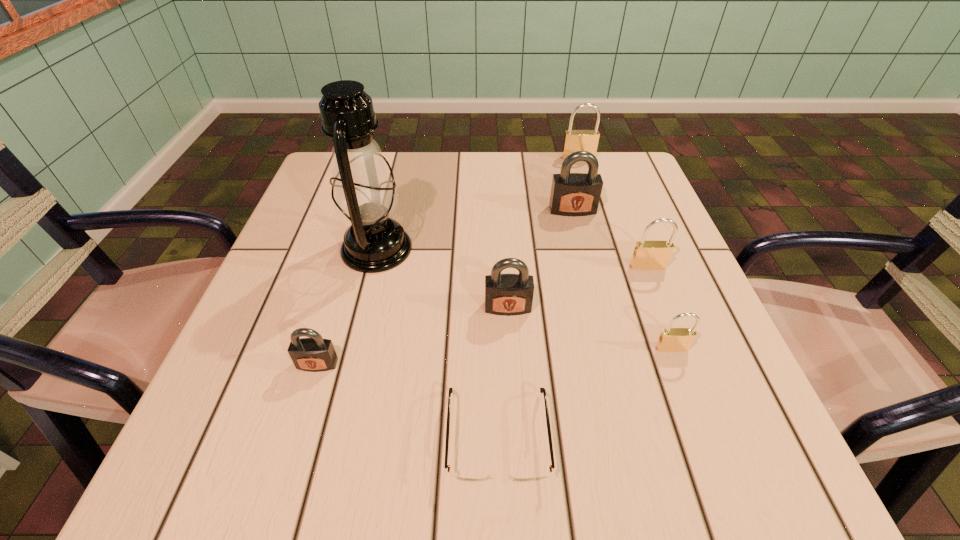
I want to click on the smallest gray padlock, so click(315, 354).

At what (x,y) coordinates should I click in order to perform the action: click on the nearest gray padlock. Please return your answer as a coordinate pair (x, y). Looking at the image, I should click on tap(315, 354).

Where is `the third nearest object`? The image size is (960, 540). the third nearest object is located at coordinates (671, 339).

This screenshot has height=540, width=960. In order to click on the second nearest padlock in this screenshot , I will do `click(671, 339)`.

Where is `the nearest object`? The width and height of the screenshot is (960, 540). the nearest object is located at coordinates (462, 475).

At what (x,y) coordinates should I click in order to perform the action: click on black spectacles. Please return your answer as a coordinate pair (x, y). The image size is (960, 540). Looking at the image, I should click on (462, 475).

You are a GUI agent. You are given a task and a screenshot of the screen. Output one action in this format:
    pyautogui.click(x=<x>, y=<y>)
    Task: Click on the free space located 0.370m on the front of the black oil lamp
    Image resolution: width=960 pixels, height=540 pixels.
    Given the screenshot: What is the action you would take?
    pyautogui.click(x=322, y=471)

Find the location of `vacant region located 0.050m on the front-facing side of the farthest padlock`. vacant region located 0.050m on the front-facing side of the farthest padlock is located at coordinates tap(582, 170).

Where is `vacant space located on the front of the rightmost gray padlock near the keyhole`? This screenshot has width=960, height=540. vacant space located on the front of the rightmost gray padlock near the keyhole is located at coordinates (585, 259).

This screenshot has width=960, height=540. I want to click on vacant position located 0.170m on the front of the fifth padlock from right to left near the keyhole, so click(x=514, y=402).